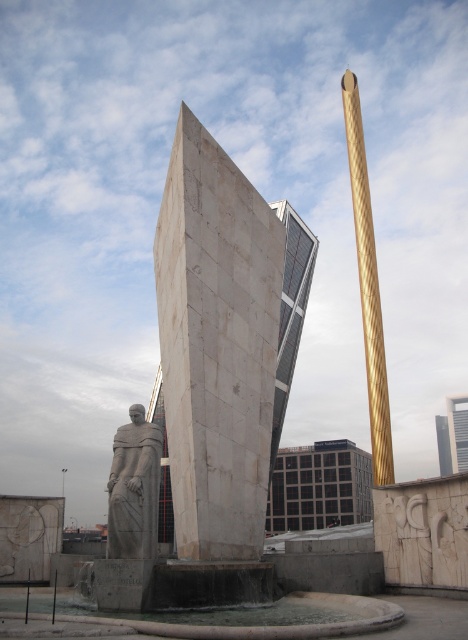
Question: Is gold textured obelisk at upper right to the right of gray stone statue at lower left from the viewer's perspective?

Choices:
 (A) no
 (B) yes

Answer: (B)

Question: Which point is closer to the camera?

Choices:
 (A) (109, 477)
 (B) (350, 120)

Answer: (A)

Question: Considering the relative positions of gold textured obelisk at upper right and gray stone statue at lower left in the image provided, where is gold textured obelisk at upper right located with respect to gray stone statue at lower left?

Choices:
 (A) below
 (B) above

Answer: (B)

Question: Which object is farther from the camera taking this photo?

Choices:
 (A) gray stone statue at lower left
 (B) gold textured obelisk at upper right

Answer: (B)

Question: Does gold textured obelisk at upper right appear over gray stone statue at lower left?

Choices:
 (A) yes
 (B) no

Answer: (A)